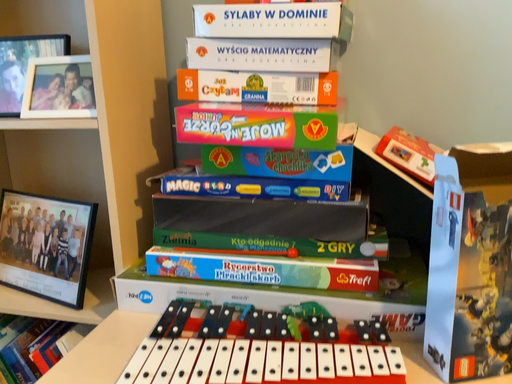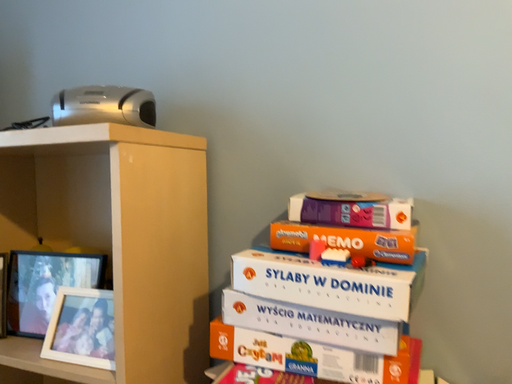
Question: Which way did the camera rotate in the video?

Choices:
 (A) rotated left
 (B) rotated right

Answer: (A)